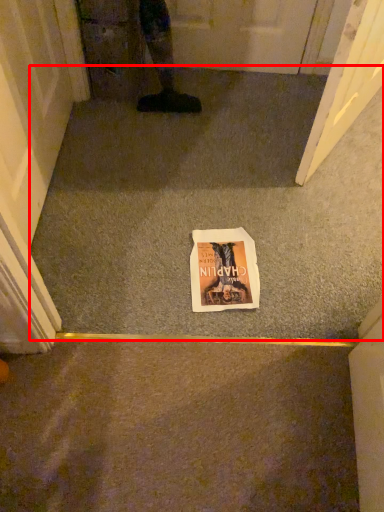
Question: Where is concrete (annotated by the red box) located in relation to comic book in the image?

Choices:
 (A) left
 (B) right

Answer: (B)